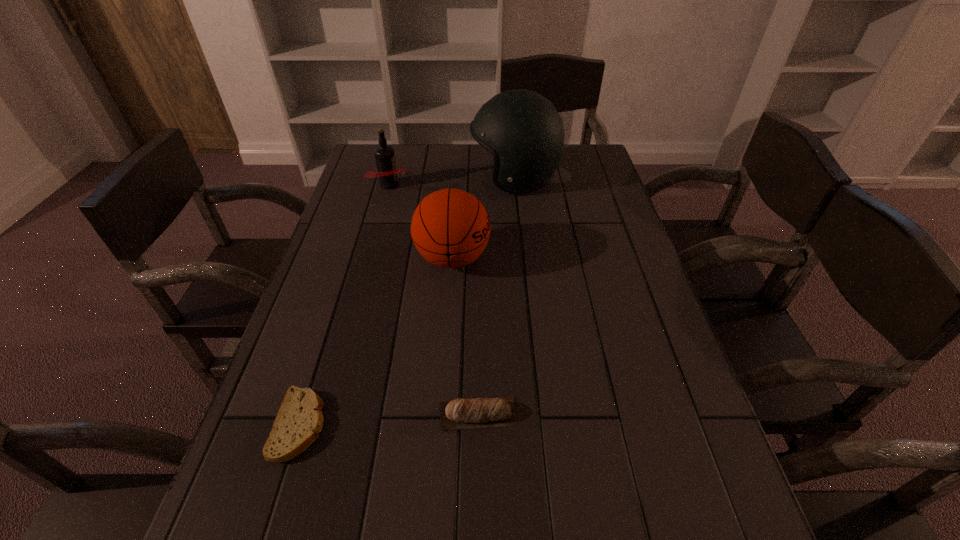
You are a GUI agent. You are given a task and a screenshot of the screen. Output one action in this format:
    pyautogui.click(x=<x>, y=<y>)
    Task: Click on the tallest object
    The height and width of the screenshot is (540, 960).
    Given the screenshot: What is the action you would take?
    pyautogui.click(x=522, y=129)

Locate an element on the screen. basketball is located at coordinates (450, 228).

What are the coordinates of `root beer` in the screenshot? It's located at (387, 172).

Where is `the second shortest object`? This screenshot has width=960, height=540. the second shortest object is located at coordinates (459, 413).

At what (x,y) coordinates should I click in order to perform the action: click on the right pita bread. Please return your answer as a coordinate pair (x, y). Looking at the image, I should click on click(459, 413).

Find the location of a particular element. The image size is (960, 540). the left pita bread is located at coordinates (299, 420).

You are a GUI agent. You are given a task and a screenshot of the screen. Output one action in this format:
    pyautogui.click(x=<x>, y=<y>)
    Task: Click on the shortest object
    This screenshot has width=960, height=540.
    Given the screenshot: What is the action you would take?
    pyautogui.click(x=299, y=420)

This screenshot has width=960, height=540. I want to click on vacant space located at the face opening of the football helmet, so click(413, 179).

Locate an element on the screen. The height and width of the screenshot is (540, 960). vacant area situated at the face opening of the football helmet is located at coordinates (437, 179).

The width and height of the screenshot is (960, 540). Find the location of `vacant position located 0.230m at the face opening of the football helmet`. vacant position located 0.230m at the face opening of the football helmet is located at coordinates (401, 179).